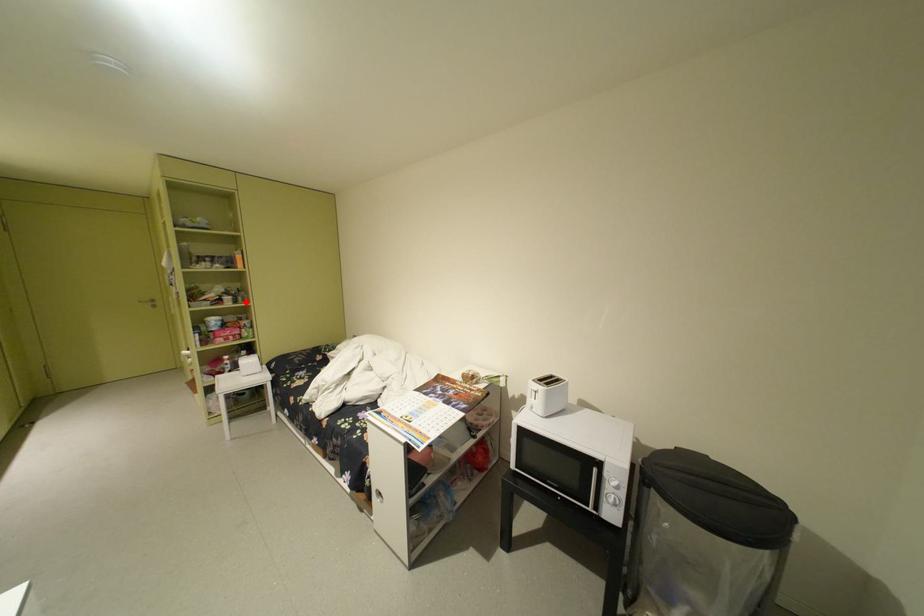
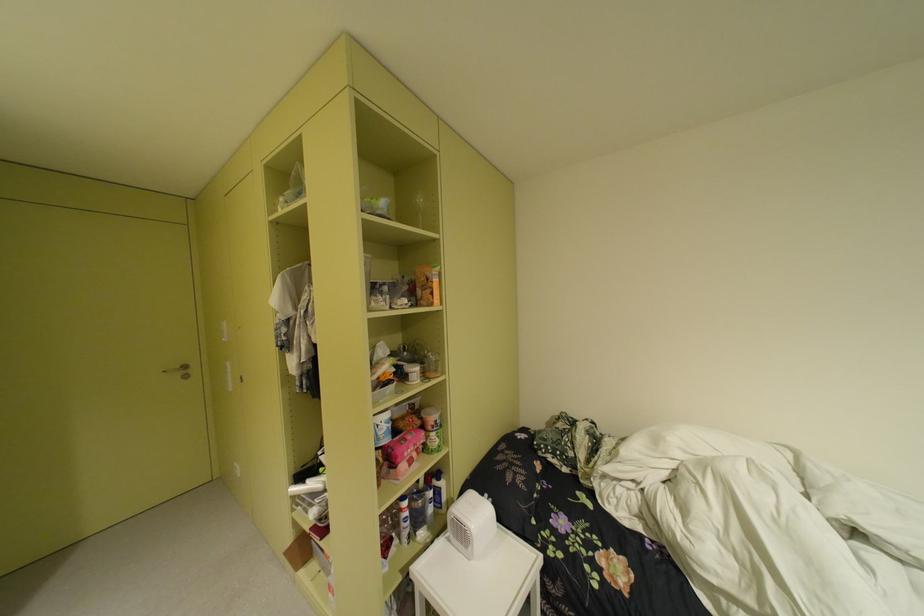
Where in the second image is the point corresponding to the highlighted location from the first image?

(434, 376)